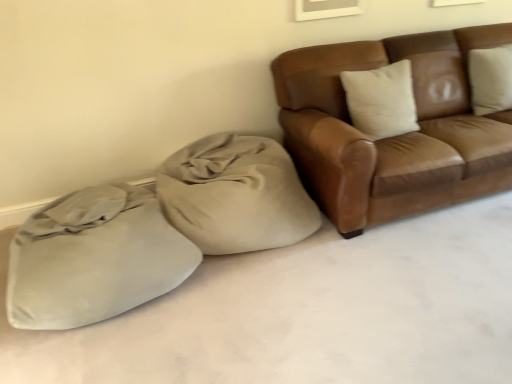
The width and height of the screenshot is (512, 384). What are the coordinates of `suede-like beige sack at lower left` in the screenshot? It's located at (94, 258).

The width and height of the screenshot is (512, 384). I want to click on beige fabric bean bag at center, so click(236, 195).

Locate an element on the screen. The width and height of the screenshot is (512, 384). suede-like beige sack at lower left is located at coordinates (94, 258).

Can you tell me how much brown leather couch at upper right and suede-like beige sack at lower left differ in facing direction?

0.000511 degrees.

Can suede-like beige sack at lower left be found inside brown leather couch at upper right?

No.

How distant is brown leather couch at upper right from suede-like beige sack at lower left?

The distance of brown leather couch at upper right from suede-like beige sack at lower left is 4.22 feet.

Can you confirm if brown leather couch at upper right is thinner than suede-like beige sack at lower left?

Correct, the width of brown leather couch at upper right is less than that of suede-like beige sack at lower left.

Looking at the image, does beige fabric bean bag at center seem bigger or smaller compared to suede-like beige sack at lower left?

In the image, beige fabric bean bag at center appears to be smaller than suede-like beige sack at lower left.

Which of these two, beige fabric bean bag at center or suede-like beige sack at lower left, stands shorter?

suede-like beige sack at lower left is shorter.

Locate an element on the screen. bean bag chair that is above the suede-like beige sack at lower left (from a real-world perspective) is located at coordinates (236, 195).

Is brown leather couch at upper right in front of or behind beige fabric bean bag at center in the image?

Visually, brown leather couch at upper right is located in front of beige fabric bean bag at center.

Is brown leather couch at upper right bigger or smaller than beige fabric bean bag at center?

Clearly, brown leather couch at upper right is larger in size than beige fabric bean bag at center.

Is brown leather couch at upper right not within beige fabric bean bag at center?

That's correct, brown leather couch at upper right is outside of beige fabric bean bag at center.

Which point is more distant from viewer, (464, 197) or (248, 165)?

The point (464, 197) is farther from the camera.

Can you confirm if beige fabric bean bag at center is bigger than brown leather couch at upper right?

No, beige fabric bean bag at center is not bigger than brown leather couch at upper right.

From a real-world perspective, which object stands above the other?

brown leather couch at upper right.

Consider the image. Who is shorter, beige fabric bean bag at center or brown leather couch at upper right?

beige fabric bean bag at center is shorter.

Is beige fabric bean bag at center to the right of brown leather couch at upper right from the viewer's perspective?

In fact, beige fabric bean bag at center is to the left of brown leather couch at upper right.

Consider the image. Which of these two, suede-like beige sack at lower left or beige fabric bean bag at center, is thinner?

beige fabric bean bag at center.

Does suede-like beige sack at lower left lie behind beige fabric bean bag at center?

No.

Which is behind, point (82, 292) or point (295, 229)?

The point (295, 229) is more distant.

Which of these two, suede-like beige sack at lower left or beige fabric bean bag at center, stands taller?

beige fabric bean bag at center is taller.

How different are the orientations of suede-like beige sack at lower left and brown leather couch at upper right in degrees?

The facing directions of suede-like beige sack at lower left and brown leather couch at upper right are 0.000511 degrees apart.

Is brown leather couch at upper right at the back of suede-like beige sack at lower left?

No.

Considering the sizes of objects suede-like beige sack at lower left and brown leather couch at upper right in the image provided, who is wider, suede-like beige sack at lower left or brown leather couch at upper right?

With larger width is suede-like beige sack at lower left.

Which is more to the left, suede-like beige sack at lower left or brown leather couch at upper right?

suede-like beige sack at lower left is more to the left.

This screenshot has height=384, width=512. What are the coordinates of `studio couch on the right of the suede-like beige sack at lower left` in the screenshot? It's located at (396, 136).

The width and height of the screenshot is (512, 384). In the image, there is a beige fabric bean bag at center. What are the coordinates of `sack below it (from a real-world perspective)` in the screenshot? It's located at (94, 258).

Estimate the real-world distances between objects in this image. Which object is closer to beige fabric bean bag at center, brown leather couch at upper right or suede-like beige sack at lower left?

suede-like beige sack at lower left is closer to beige fabric bean bag at center.

Looking at the image, which one is located further to suede-like beige sack at lower left, beige fabric bean bag at center or brown leather couch at upper right?

Based on the image, brown leather couch at upper right appears to be further to suede-like beige sack at lower left.

Looking at the image, which one is located closer to suede-like beige sack at lower left, brown leather couch at upper right or beige fabric bean bag at center?

beige fabric bean bag at center lies closer to suede-like beige sack at lower left than the other object.

Based on their spatial positions, is beige fabric bean bag at center or suede-like beige sack at lower left closer to brown leather couch at upper right?

Among the two, beige fabric bean bag at center is located nearer to brown leather couch at upper right.

When comparing their distances from beige fabric bean bag at center, does suede-like beige sack at lower left or brown leather couch at upper right seem closer?

Based on the image, suede-like beige sack at lower left appears to be nearer to beige fabric bean bag at center.

Looking at the image, which one is located further to brown leather couch at upper right, suede-like beige sack at lower left or beige fabric bean bag at center?

suede-like beige sack at lower left lies further to brown leather couch at upper right than the other object.

The image size is (512, 384). Find the location of `bean bag chair located between suede-like beige sack at lower left and brown leather couch at upper right in the left-right direction`. bean bag chair located between suede-like beige sack at lower left and brown leather couch at upper right in the left-right direction is located at coordinates (236, 195).